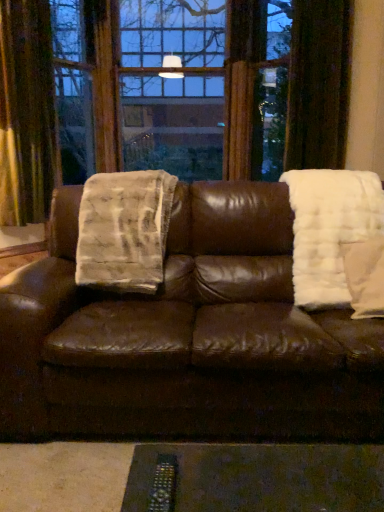
Question: Can you confirm if brown leather couch at center is shorter than white fluffy pillow at right?

Choices:
 (A) no
 (B) yes

Answer: (A)

Question: Can you confirm if brown leather couch at center is taller than white fluffy pillow at right?

Choices:
 (A) no
 (B) yes

Answer: (B)

Question: From the image's perspective, is brown leather couch at center located above white fluffy pillow at right?

Choices:
 (A) yes
 (B) no

Answer: (B)

Question: Does brown leather couch at center have a smaller size compared to white fluffy pillow at right?

Choices:
 (A) no
 (B) yes

Answer: (A)

Question: Does brown leather couch at center have a larger size compared to white fluffy pillow at right?

Choices:
 (A) yes
 (B) no

Answer: (A)

Question: Considering their positions, is white fluffy pillow at right located in front of or behind velvet gold curtain at left?

Choices:
 (A) behind
 (B) front

Answer: (B)

Question: Considering the positions of white fluffy pillow at right and velvet gold curtain at left in the image, is white fluffy pillow at right wider or thinner than velvet gold curtain at left?

Choices:
 (A) wide
 (B) thin

Answer: (A)

Question: In terms of size, does white fluffy pillow at right appear bigger or smaller than velvet gold curtain at left?

Choices:
 (A) big
 (B) small

Answer: (B)

Question: From a real-world perspective, is white fluffy pillow at right positioned above or below velvet gold curtain at left?

Choices:
 (A) below
 (B) above

Answer: (A)

Question: From the image's perspective, is brown leather couch at center positioned above or below velvet gold curtain at left?

Choices:
 (A) below
 (B) above

Answer: (A)

Question: Is brown leather couch at center in front of or behind velvet gold curtain at left in the image?

Choices:
 (A) behind
 (B) front

Answer: (B)

Question: From a real-world perspective, relative to velvet gold curtain at left, is brown leather couch at center vertically above or below?

Choices:
 (A) below
 (B) above

Answer: (A)

Question: Does point (218, 307) appear closer or farther from the camera than point (51, 40)?

Choices:
 (A) farther
 (B) closer

Answer: (B)

Question: Does point (180, 352) appear closer or farther from the camera than point (352, 201)?

Choices:
 (A) farther
 (B) closer

Answer: (B)

Question: From a real-world perspective, is brown leather couch at center positioned above or below white fluffy blanket at right, acting as the second blanket starting from the left?

Choices:
 (A) below
 (B) above

Answer: (A)